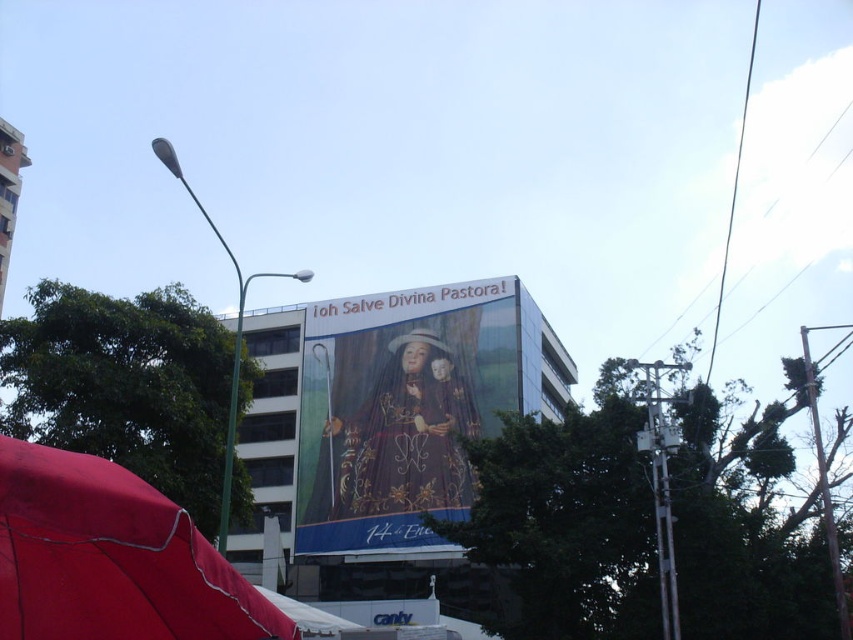
Can you confirm if matte gold painting at center is wider than red fabric umbrella at lower left?

Yes.

Is point (450, 476) behind point (48, 554)?

Yes.

Which is in front, point (334, 516) or point (128, 545)?

Positioned in front is point (128, 545).

Find the location of a particular element. matte gold painting at center is located at coordinates (399, 410).